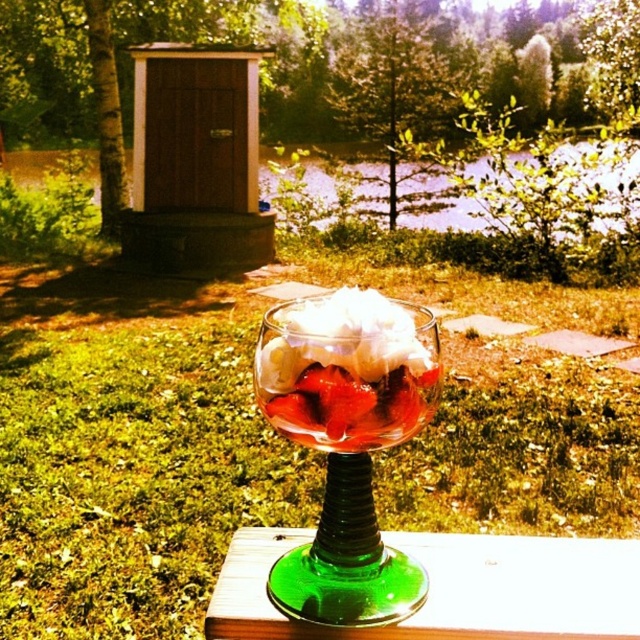
Between green glass wine glass at center and clear glass bowl at center, which one has more height?

green glass wine glass at center

Who is more forward, (420, 365) or (355, 448)?

Positioned in front is point (420, 365).

Where is `green glass wine glass at center`? green glass wine glass at center is located at coordinates (x=348, y=442).

The height and width of the screenshot is (640, 640). Describe the element at coordinates (452, 588) in the screenshot. I see `green glass table at center` at that location.

Does green glass table at center appear on the left side of clear glass bowl at center?

Incorrect, green glass table at center is not on the left side of clear glass bowl at center.

Identify the location of green glass table at center. Image resolution: width=640 pixels, height=640 pixels. (452, 588).

Locate an element on the screen. green glass table at center is located at coordinates (452, 588).

Does green glass wine glass at center appear on the right side of green glass table at center?

No, green glass wine glass at center is not to the right of green glass table at center.

Which is below, green glass wine glass at center or green glass table at center?

green glass table at center is lower down.

Is point (368, 589) less distant than point (600, 586)?

Yes.

The image size is (640, 640). I want to click on green glass wine glass at center, so click(x=348, y=442).